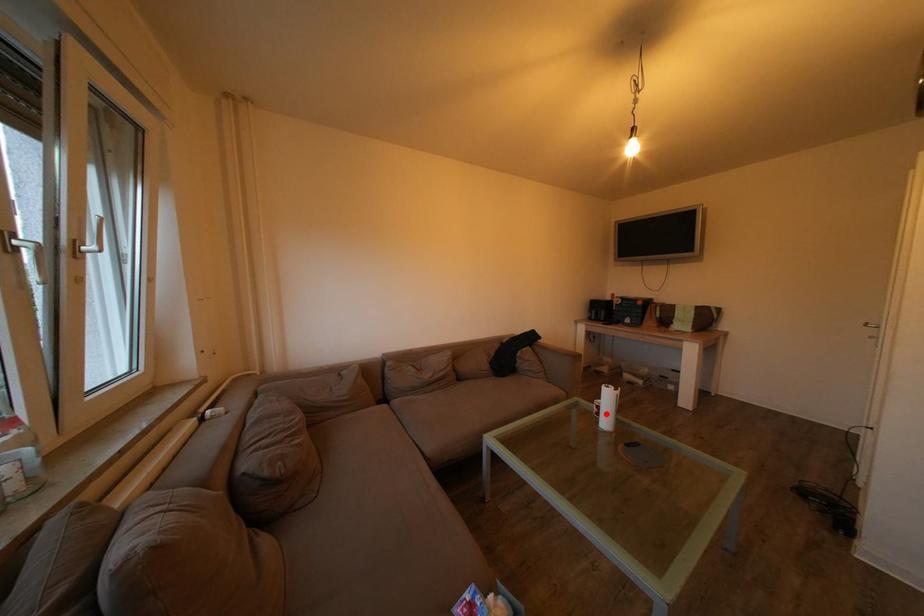
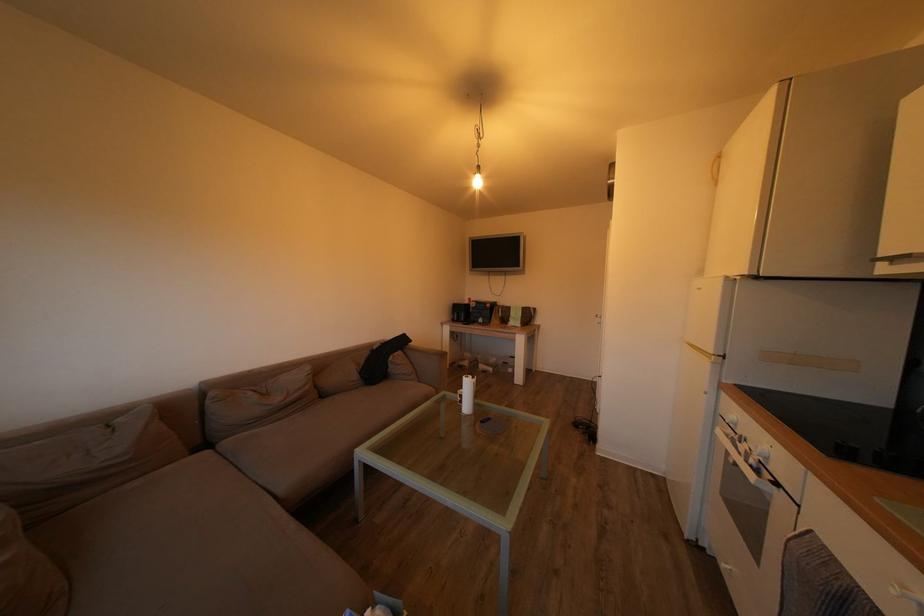
Locate, in the second image, the point that corresponds to the highlighted location in the first image.

(468, 402)